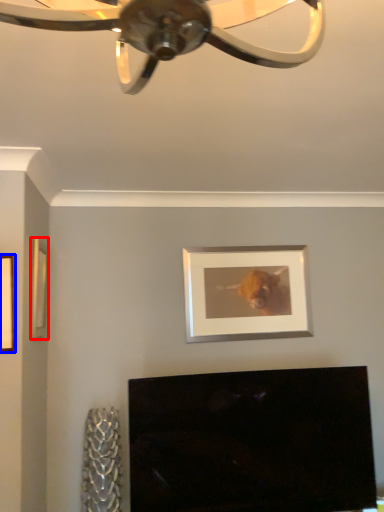
Question: Which object is further to the camera taking this photo, picture frame (highlighted by a red box) or picture frame (highlighted by a blue box)?

Choices:
 (A) picture frame
 (B) picture frame

Answer: (A)